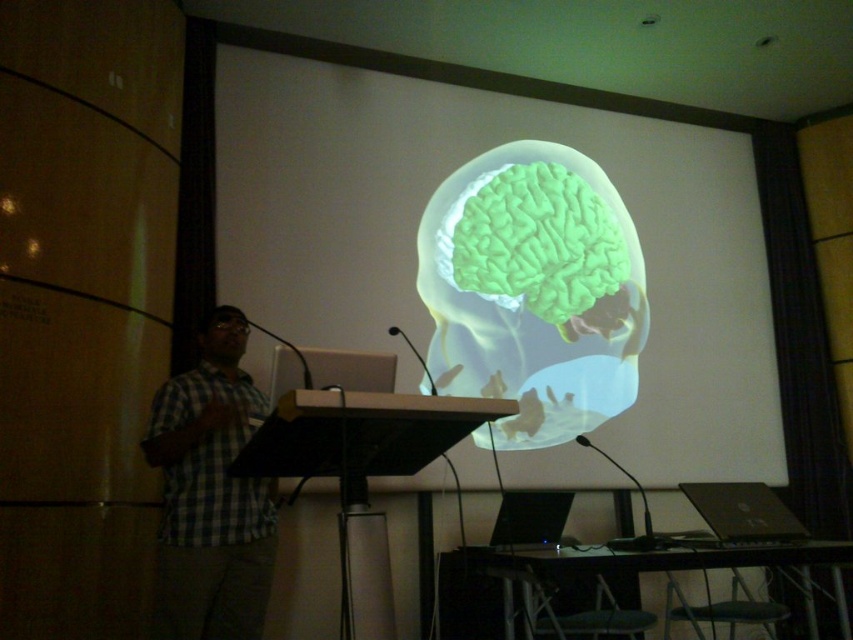
You are an attendee at the presentation. You notice the transparent plastic brain at center and the checkered fabric shirt at left. Which object is positioned higher in the image?

The transparent plastic brain at center is positioned higher than the checkered fabric shirt at left.

You are an attendee at the presentation. You see the point marked at coordinate (743, 512). What object is located at that position?

The point at coordinate (743, 512) indicates the black plastic laptop at lower right.